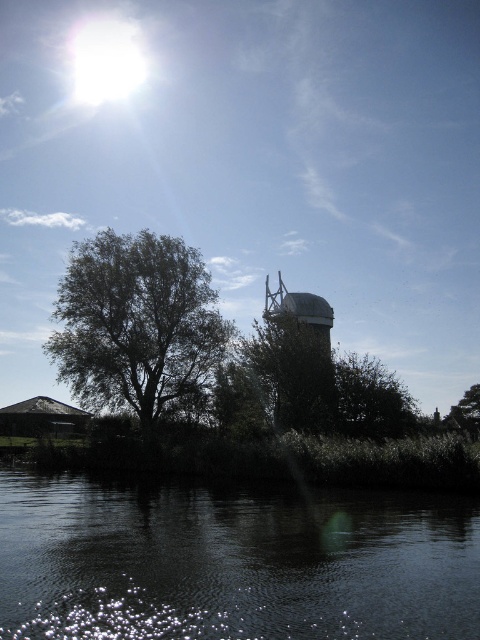
Is green leafy tree at left smaller than green leafy tree at lower right?

Indeed, green leafy tree at left has a smaller size compared to green leafy tree at lower right.

Looking at this image, which is more to the left, green leafy tree at left or green leafy tree at lower right?

From the viewer's perspective, green leafy tree at left appears more on the left side.

Locate an element on the screen. The width and height of the screenshot is (480, 640). green leafy tree at left is located at coordinates (135, 323).

What do you see at coordinates (372, 397) in the screenshot?
I see `green leafy tree at center` at bounding box center [372, 397].

Who is taller, green leafy tree at center or green leafy tree at lower right?

green leafy tree at center

Does point (393, 422) come closer to viewer compared to point (464, 392)?

Yes, it is.

Locate an element on the screen. green leafy tree at center is located at coordinates (372, 397).

Does dark reflective water at lower center appear on the left side of green leafy tree at left?

In fact, dark reflective water at lower center is to the right of green leafy tree at left.

Does dark reflective water at lower center appear on the right side of green leafy tree at left?

Correct, you'll find dark reflective water at lower center to the right of green leafy tree at left.

Describe the element at coordinates (231, 561) in the screenshot. Image resolution: width=480 pixels, height=640 pixels. I see `dark reflective water at lower center` at that location.

Locate an element on the screen. dark reflective water at lower center is located at coordinates (231, 561).